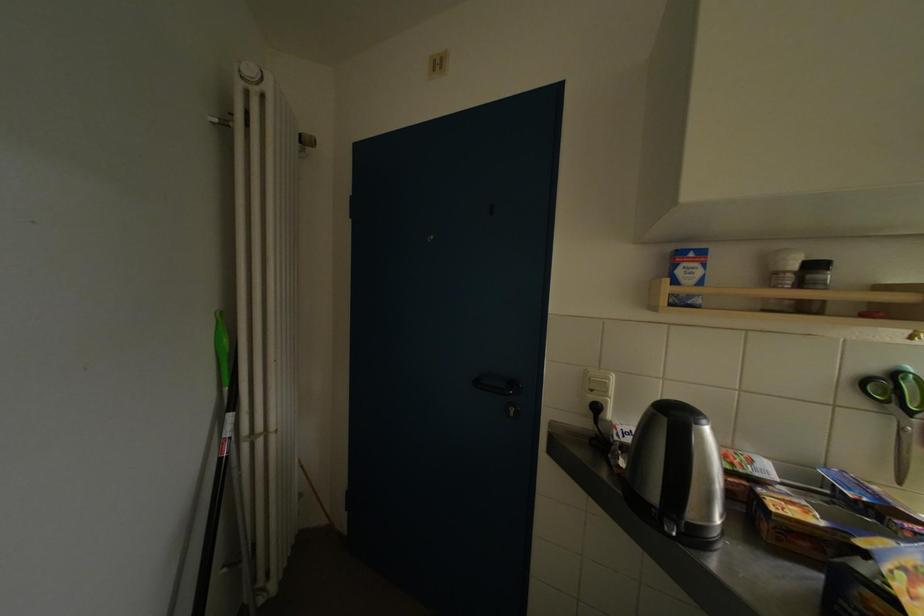
At what (x,y) coordinates should I click in order to perform the action: click on green handle scissors. Please return your answer as a coordinate pair (x, y). Looking at the image, I should click on (897, 410).